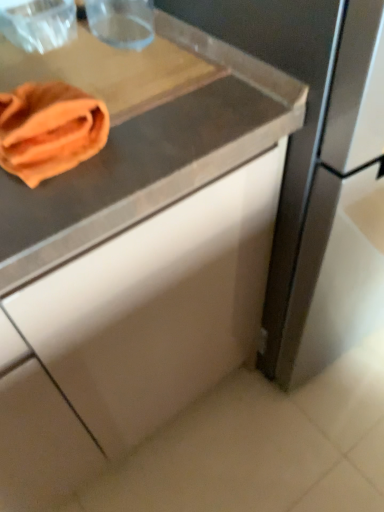
This screenshot has height=512, width=384. What are the coordinates of `unoccupied space behind orange microfiber cloth at upper left` in the screenshot? It's located at (68, 69).